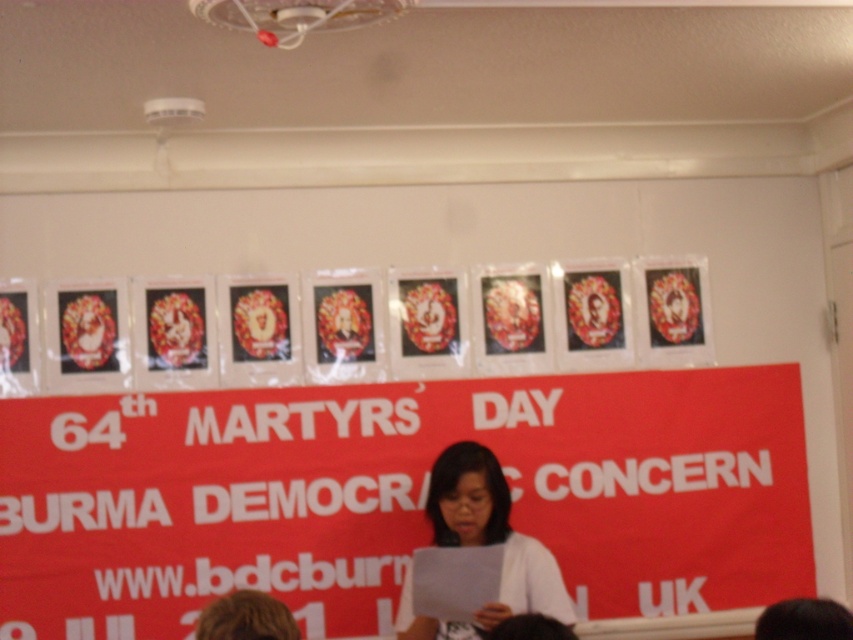
You are organizing a presentation and need to place both the red matte poster at center and the white paper at center on a wall. Given their sizes, which object should you place higher up to ensure both are visible without overlapping?

The red matte poster at center is much taller than the white paper at center. To ensure visibility without overlapping, place the taller red matte poster at center lower so the shorter white paper at center can be positioned above it.